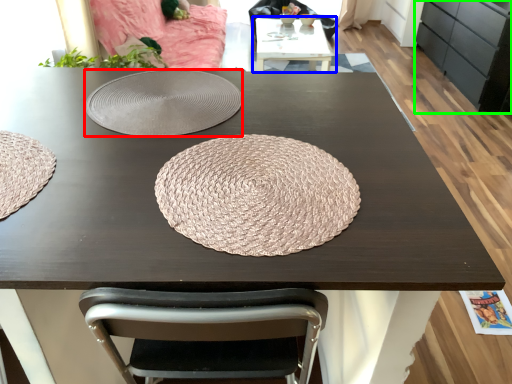
Question: Based on their relative distances, which object is farther from plate (highlighted by a red box)? Choose from table (highlighted by a blue box) and cabinetry (highlighted by a green box).

Choices:
 (A) table
 (B) cabinetry

Answer: (B)